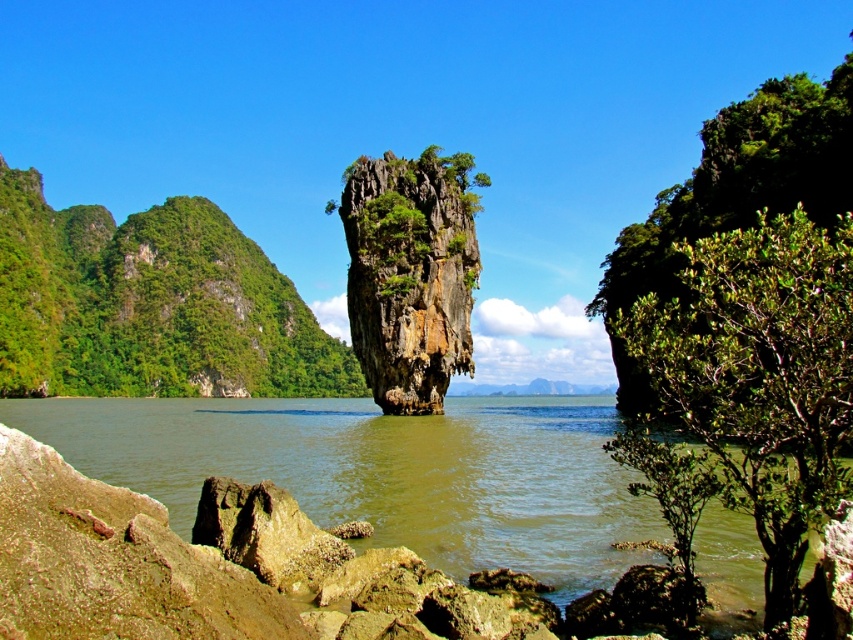
You are a hiker standing at the water edge near the foreground rocks. You want to take a photo of the rusty brown rock at center with the green leafy shrub at right in the background. Is the shrub positioned in a way that it can be captured in the background of the rock?

The green leafy shrub at right is located below the rusty brown rock at center, so when taking a photo of the rock, the shrub would appear below it rather than in the background. To have the shrub in the background behind the rock, it would need to be positioned behind it spatially, but since it is below, it might not frame as intended unless the angle allows capturing both with the shrub behind.

In the scene shown: You are standing on the shore looking at the scene. Which object is positioned higher relative to the other? The green leafy tree at left or the rusty brown rock at center?

The green leafy tree at left is located above the rusty brown rock at center, so it is positioned higher relative to the other.